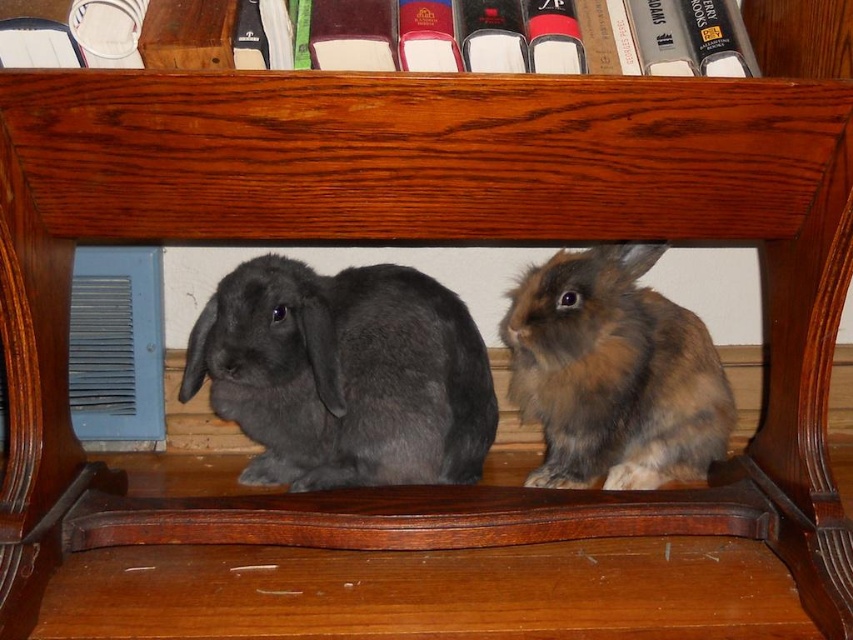
Question: Which point is closer to the camera?

Choices:
 (A) matte gray rabbit at center
 (B) brown fluffy rabbit at center

Answer: (A)

Question: Is matte gray rabbit at center further to camera compared to brown fluffy rabbit at center?

Choices:
 (A) no
 (B) yes

Answer: (A)

Question: Does matte gray rabbit at center appear under brown fluffy rabbit at center?

Choices:
 (A) no
 (B) yes

Answer: (B)

Question: Is matte gray rabbit at center wider than brown fluffy rabbit at center?

Choices:
 (A) no
 (B) yes

Answer: (B)